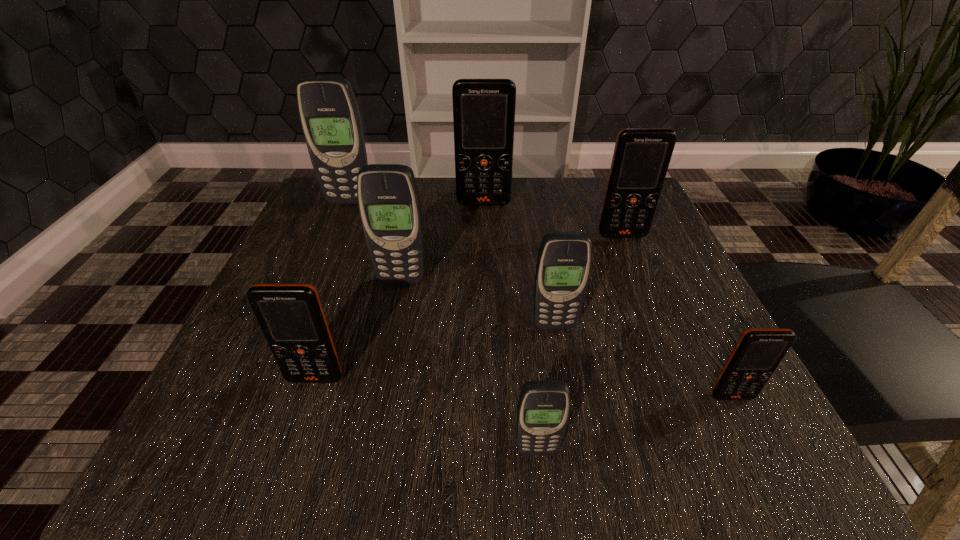
Locate an element on the screen. the biggest orange cellular telephone is located at coordinates (483, 109).

At what (x,y) coordinates should I click in order to perform the action: click on the second orange cellular telephone from left to right. Please return your answer as a coordinate pair (x, y). The image size is (960, 540). Looking at the image, I should click on (483, 109).

Identify the location of the leftmost gray cellular telephone. (329, 114).

Locate an element on the screen. This screenshot has height=540, width=960. the farthest gray cellular telephone is located at coordinates (329, 114).

I want to click on the second biggest orange cellular telephone, so click(641, 158).

What are the coordinates of `the third farthest object` in the screenshot? It's located at click(x=641, y=158).

Locate an element on the screen. the sixth object from right to left is located at coordinates [x=388, y=198].

This screenshot has width=960, height=540. Identify the location of the third nearest gray cellular telephone. (388, 198).

Locate an element on the screen. Image resolution: width=960 pixels, height=540 pixels. the third biggest gray cellular telephone is located at coordinates (564, 260).

Identify the location of the fifth farthest object. (564, 260).